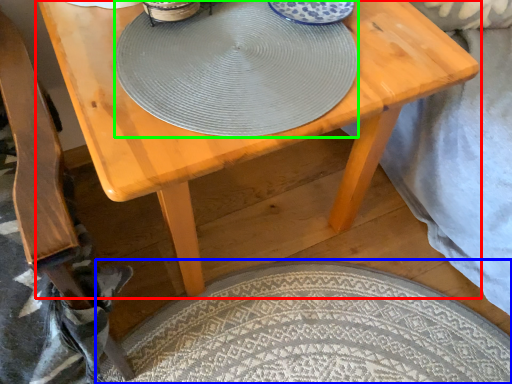
Question: Estimate the real-world distances between objects in this image. Which object is closer to table (highlighted by a red box), mat (highlighted by a blue box) or plate (highlighted by a green box)?

Choices:
 (A) mat
 (B) plate

Answer: (B)